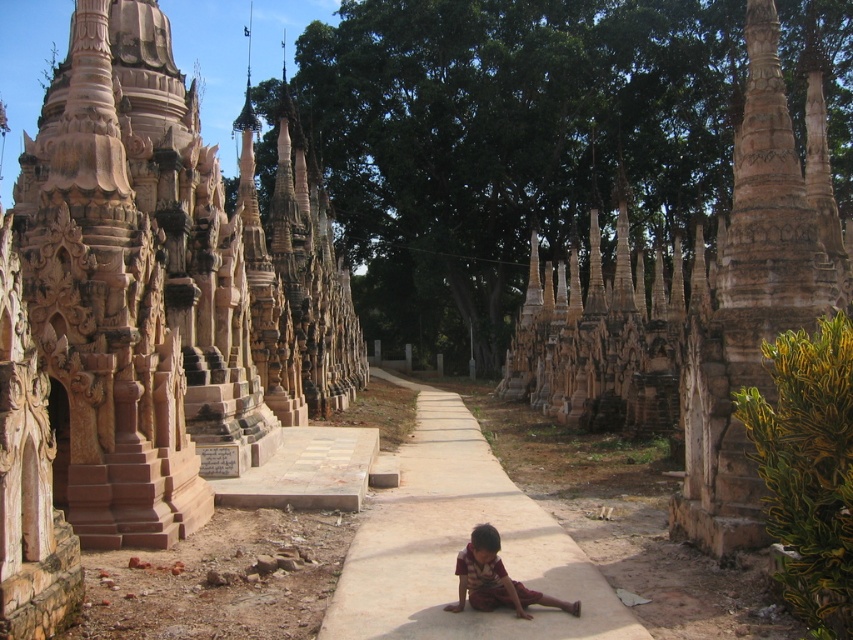
Question: Which point is closer to the camera?

Choices:
 (A) (497, 554)
 (B) (694, 356)
 (C) (422, 401)

Answer: (A)

Question: Which of the following is the closest to the observer?

Choices:
 (A) click(505, 513)
 (B) click(51, 561)
 (C) click(474, 536)

Answer: (B)

Question: Where is brown stone temple at center located in relation to sandy concrete path at center in the image?

Choices:
 (A) below
 (B) above

Answer: (B)

Question: Is smooth stone pillar at center smaller than brown fabric pants at center?

Choices:
 (A) no
 (B) yes

Answer: (A)

Question: Which point is closer to the camera?

Choices:
 (A) (434, 554)
 (B) (757, 77)
 (C) (96, 157)
 (D) (482, 608)

Answer: (D)

Question: Where is brown stone temple at center located in relation to sandy concrete path at center in the image?

Choices:
 (A) above
 (B) below

Answer: (A)